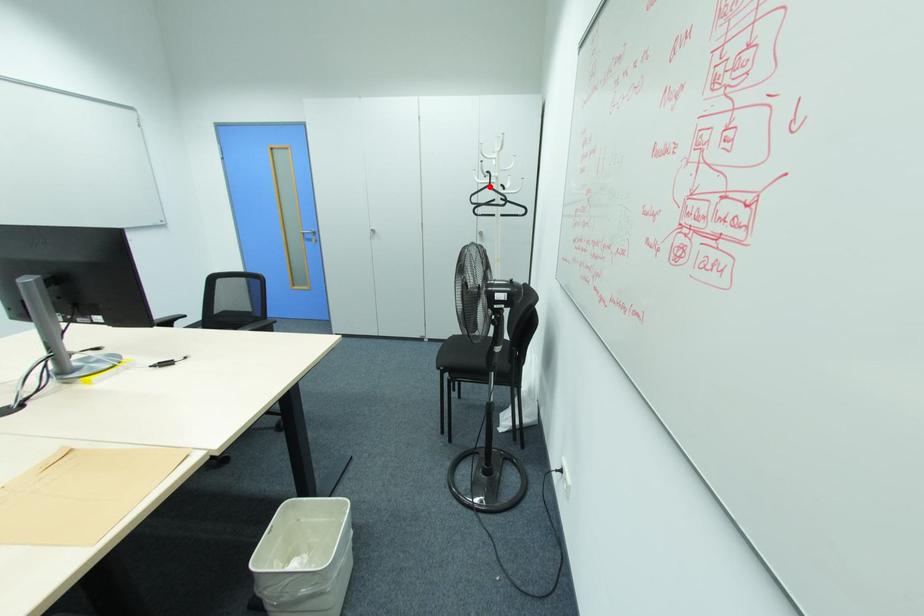
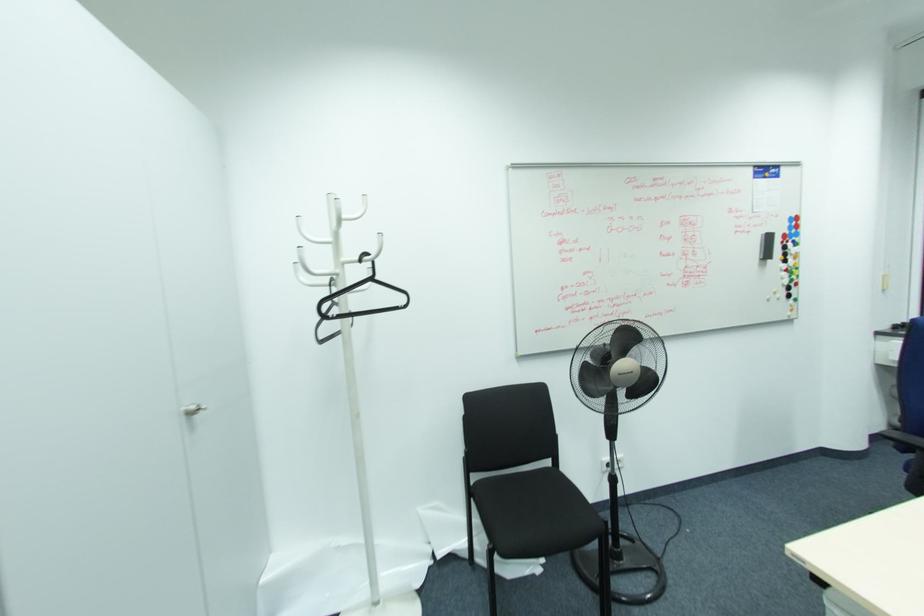
Question: I am providing you with two images of the same scene from different viewpoints. Image1 has a red point marked. In image2, the corresponding 3D location appears at what relative position? Reply with the corresponding letter.

Choices:
 (A) Closer
 (B) Farther

Answer: (B)